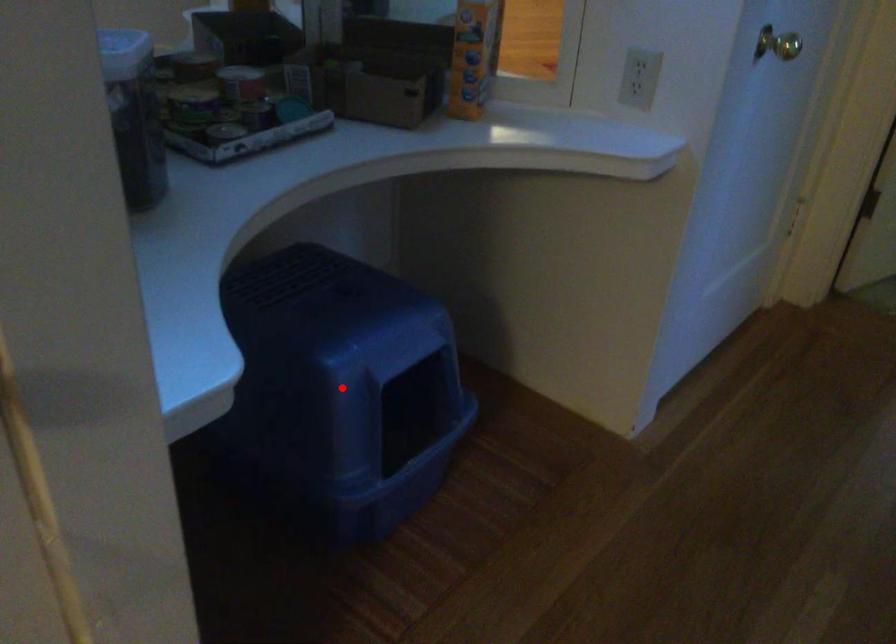
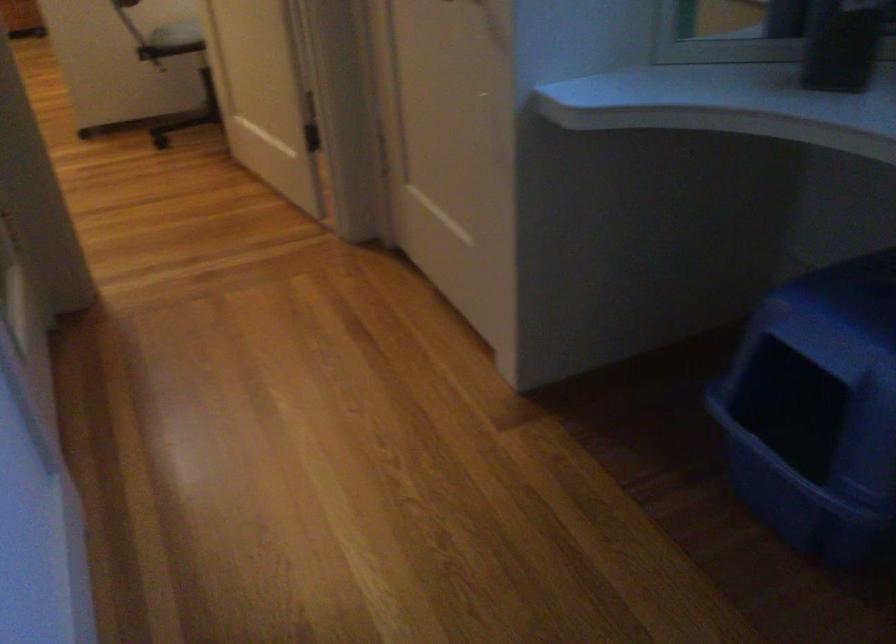
Question: I am providing you with two images of the same scene from different viewpoints. Image1 has a red point marked. In image2, the corresponding 3D location appears at what relative position? Reply with the corresponding letter.

Choices:
 (A) Closer
 (B) Farther

Answer: (B)